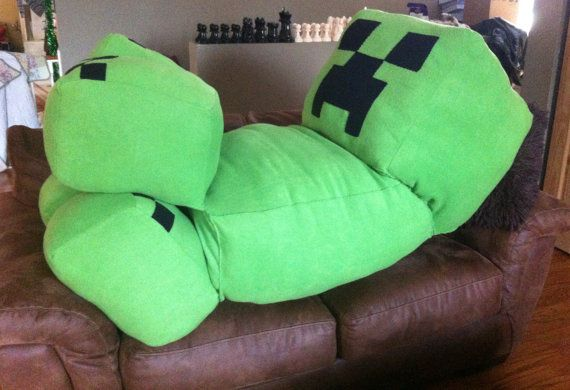
Locate an element on the screen. This screenshot has width=570, height=390. top of couch is located at coordinates (243, 118).